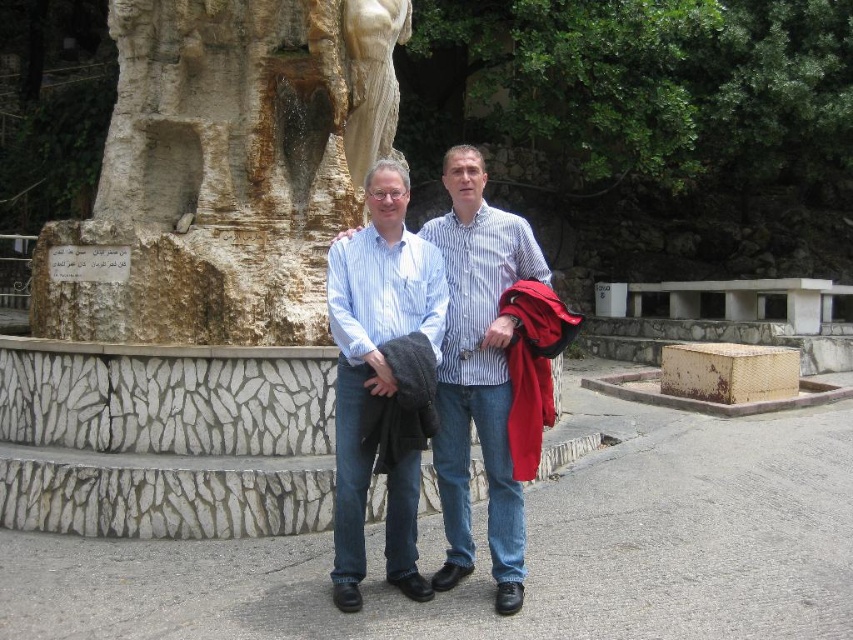
Which of these two, stone statue at left or striped cotton shirt at center, stands shorter?

striped cotton shirt at center is shorter.

Based on the photo, is stone statue at left in front of striped cotton shirt at center?

No, it is not.

This screenshot has height=640, width=853. In order to click on stone statue at left in this screenshot , I will do `click(223, 172)`.

Locate an element on the screen. This screenshot has width=853, height=640. stone statue at left is located at coordinates (223, 172).